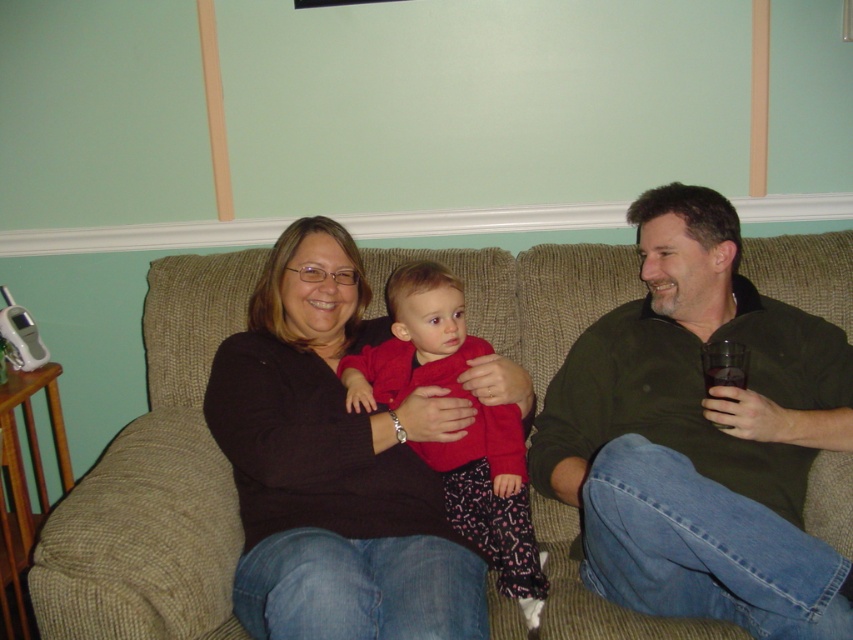
You are a delivery person who needs to place a small package between the textured beige couch at center and the matte red sweater at center. The package is 16 inches long. Can you fit it between them without moving either object?

The distance between the textured beige couch at center and the matte red sweater at center is 15.88 inches. Since the package is 16 inches long, it cannot fit between them without moving either object.

Consider the image. You are a guest entering the living room and want to greet the people on the couch. If you approach from the front, which item of clothing will you see first, the green cotton shirt at right or the matte red sweater at center?

The green cotton shirt at right is positioned over the matte red sweater at center, so you will see the green cotton shirt at right first when approaching from the front.

You are a fashion designer observing the scene. You see the black matte sweater at center and the matte red sweater at center. Which sweater is placed on top of the other?

The black matte sweater at center is positioned over the matte red sweater at center, so the black one is on top.